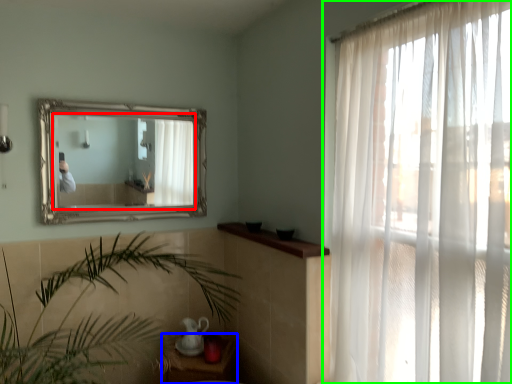
Question: Which is farther away from mirror (highlighted by a red box)? table (highlighted by a blue box) or curtain (highlighted by a green box)?

Choices:
 (A) table
 (B) curtain

Answer: (B)